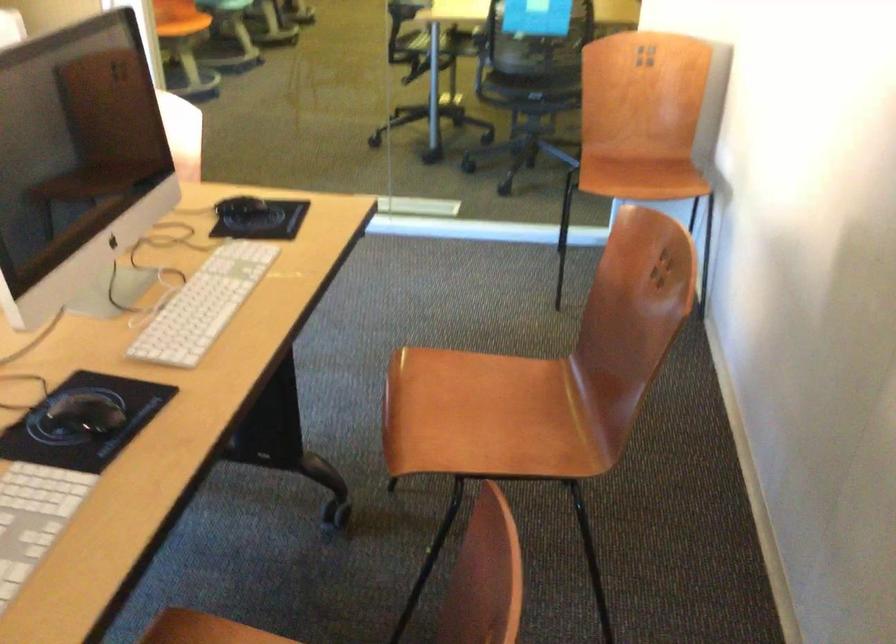
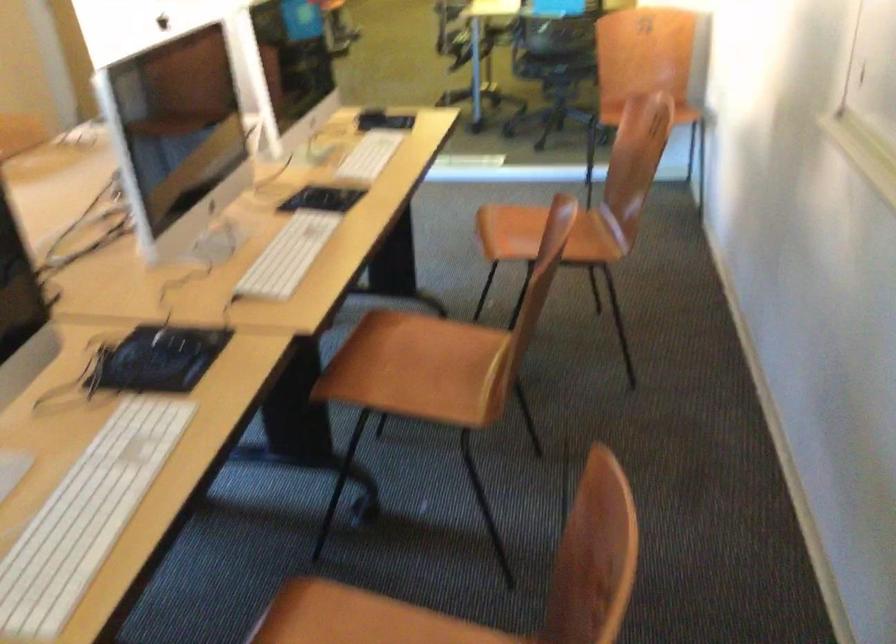
Question: Which direction would the cameraman need to move to produce the second image? Reply with the corresponding letter.

Choices:
 (A) Left
 (B) Right
 (C) Forward
 (D) Backward

Answer: (D)